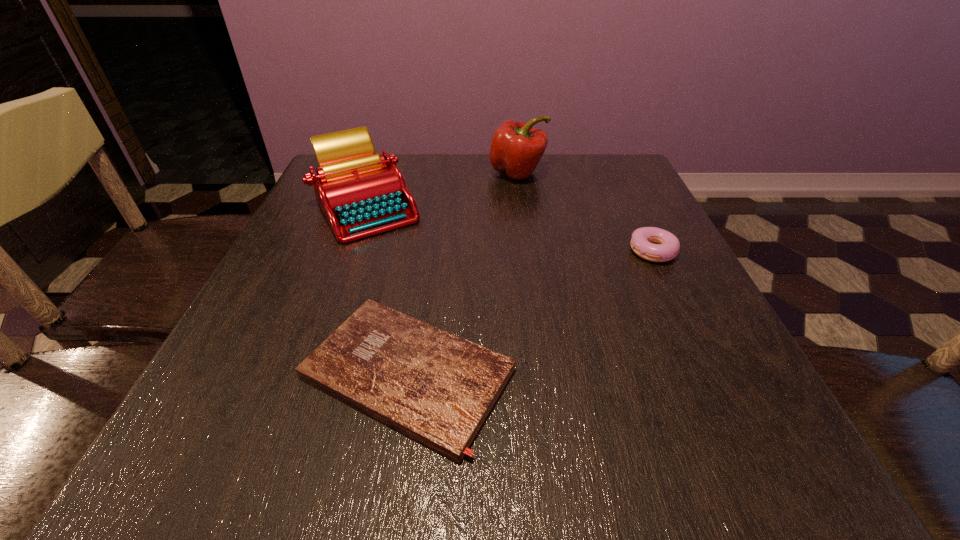
Locate an element on the screen. The image size is (960, 540). free space at the left edge of the desktop is located at coordinates (276, 264).

The height and width of the screenshot is (540, 960). In the image, there is a desktop. What are the coordinates of `free space at the right edge` in the screenshot? It's located at (650, 208).

Locate an element on the screen. The width and height of the screenshot is (960, 540). vacant area at the far right corner of the desktop is located at coordinates (604, 156).

Find the location of `vacant area that lies between the pepper and the typewriter`. vacant area that lies between the pepper and the typewriter is located at coordinates (442, 190).

You are a GUI agent. You are given a task and a screenshot of the screen. Output one action in this format:
    pyautogui.click(x=<x>, y=<y>)
    Task: Click on the empty space that is in between the doughnut and the nearest object
    Image resolution: width=960 pixels, height=540 pixels.
    Given the screenshot: What is the action you would take?
    pyautogui.click(x=530, y=313)

Where is `unoccupied area between the typewriter and the pepper`? Image resolution: width=960 pixels, height=540 pixels. unoccupied area between the typewriter and the pepper is located at coordinates (442, 190).

Locate an element on the screen. unoccupied area between the shortest object and the third tallest object is located at coordinates (530, 313).

Where is `vacant space that is in between the typewriter and the second shortest object`? This screenshot has width=960, height=540. vacant space that is in between the typewriter and the second shortest object is located at coordinates (x=510, y=229).

Locate an element on the screen. vacant point located between the pepper and the Bible is located at coordinates (463, 273).

Identify the location of vacant point located between the typewriter and the pepper. This screenshot has height=540, width=960. (442, 190).